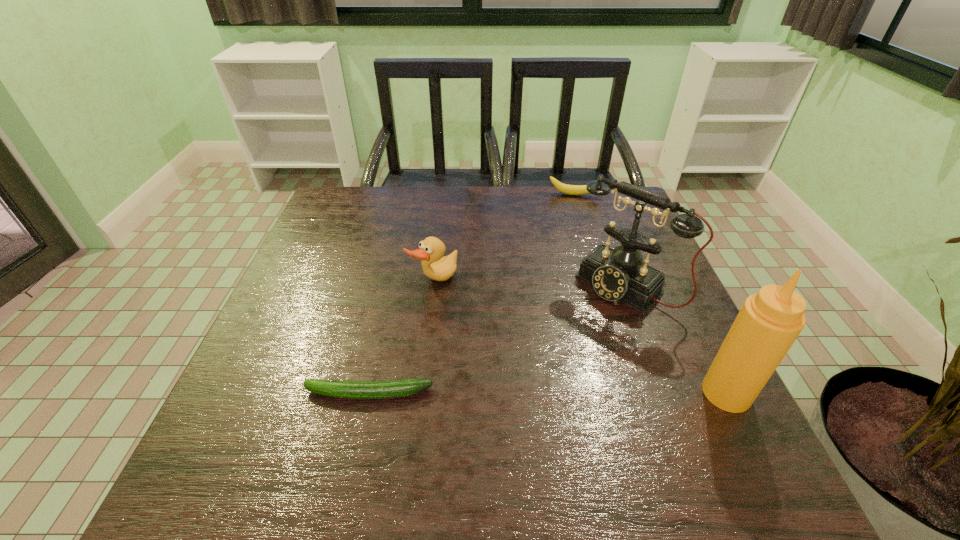
The width and height of the screenshot is (960, 540). What are the coordinates of `free space on the desktop that is between the shortest object and the condiment and is positioned on the upward curve of the farthest object` in the screenshot? It's located at (567, 393).

I want to click on free spot on the desktop that is between the zucchini and the condiment and is positioned on the beak of the duck, so click(x=582, y=393).

The height and width of the screenshot is (540, 960). In order to click on free space on the desktop that is between the shortest object and the condiment and is positioned on the dial of the telephone in this screenshot , I will do `click(517, 393)`.